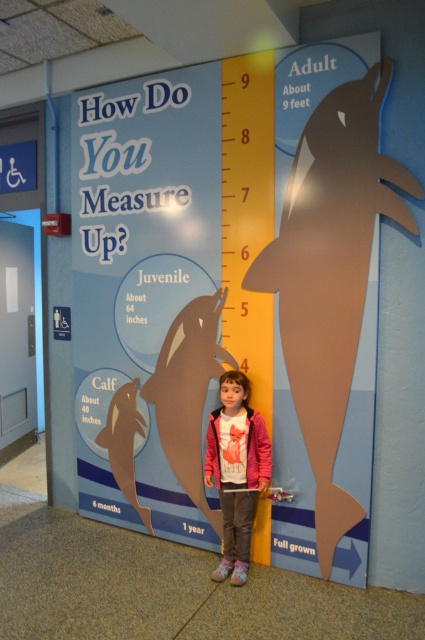
The image has a display about dolphin growth stages. There is a point marked at coordinates [248,216]. What object is located at that point?

The point at coordinates [248,216] corresponds to the yellow matte ruler at center.

You are a museum visitor who wants to measure the distance between the yellow matte ruler at center and the pink fleece jacket at center. Which object should you use as a reference for measurement?

The yellow matte ruler at center is thinner than the pink fleece jacket at center, so you should use the pink fleece jacket at center as a reference for measurement because it has a larger surface area for accurate measurement.